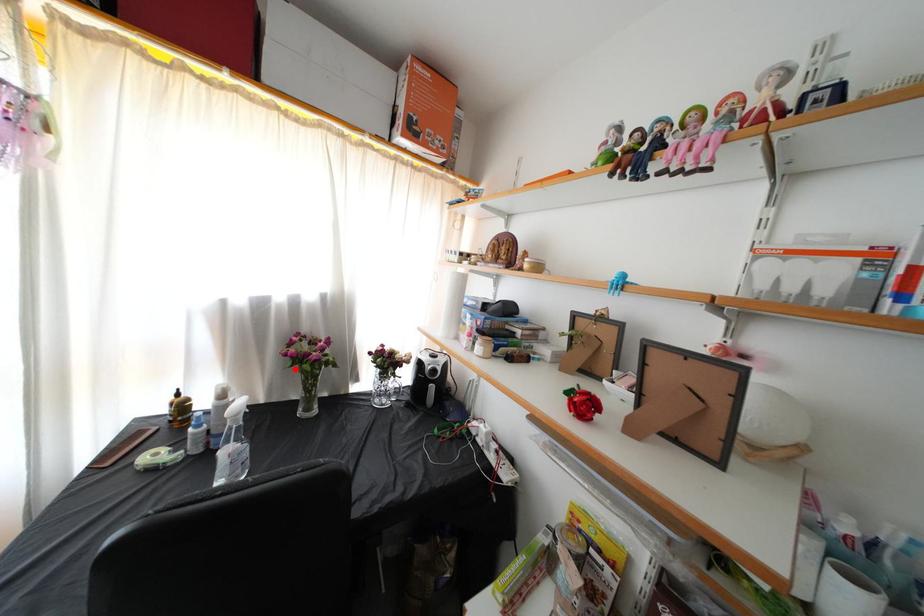
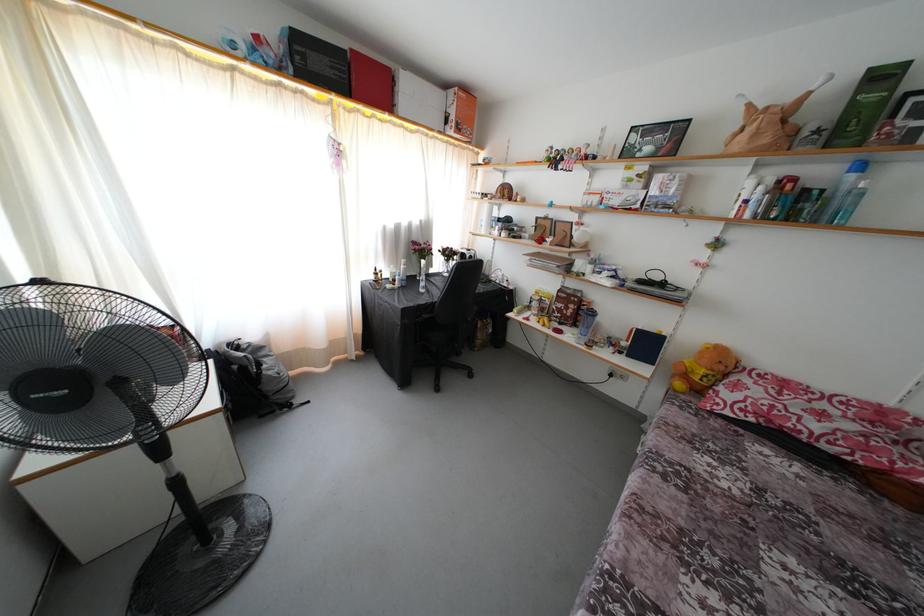
In the second image, find the point that corresponds to the highlighted location in the first image.

(422, 259)